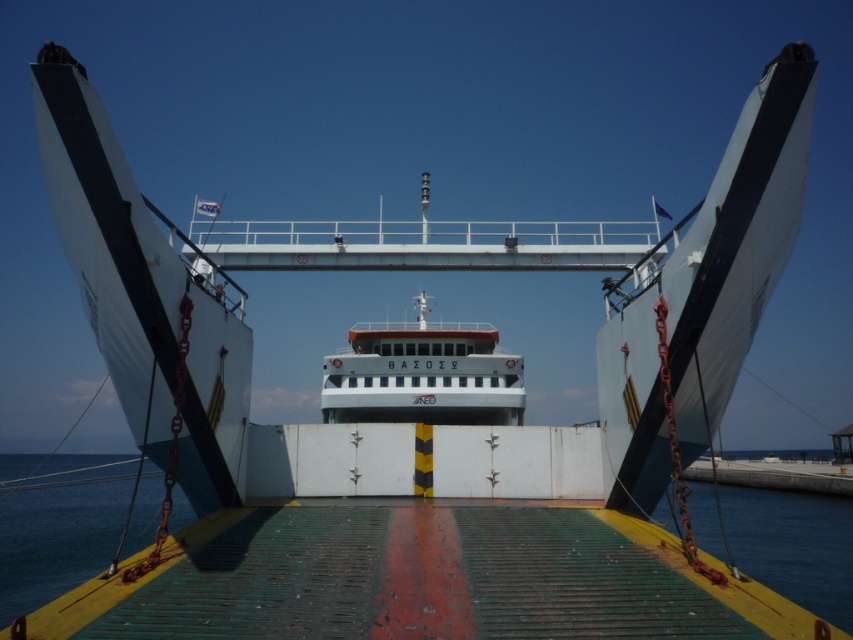
In the scene shown: You are a passenger on the ferry and want to take a photo of the white matte ship at center and the blue water at lower left. Which object will appear larger in your photo?

The blue water at lower left will appear larger in the photo because the white matte ship at center has a smaller size compared to blue water at lower left.

You are standing on the deck of a ferry and want to know how far the point marked at coordinates (467, 342) is from your current position. Can you determine the distance?

The point marked at coordinates (467, 342) is 52.92 meters away from your current position on the ferry deck.